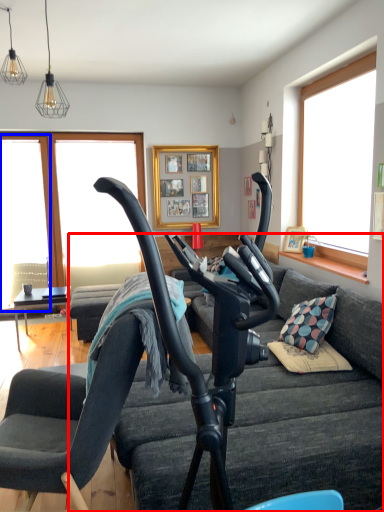
Question: Which object appears farthest to the camera in this image, studio couch (highlighted by a red box) or window screen (highlighted by a blue box)?

Choices:
 (A) studio couch
 (B) window screen

Answer: (B)